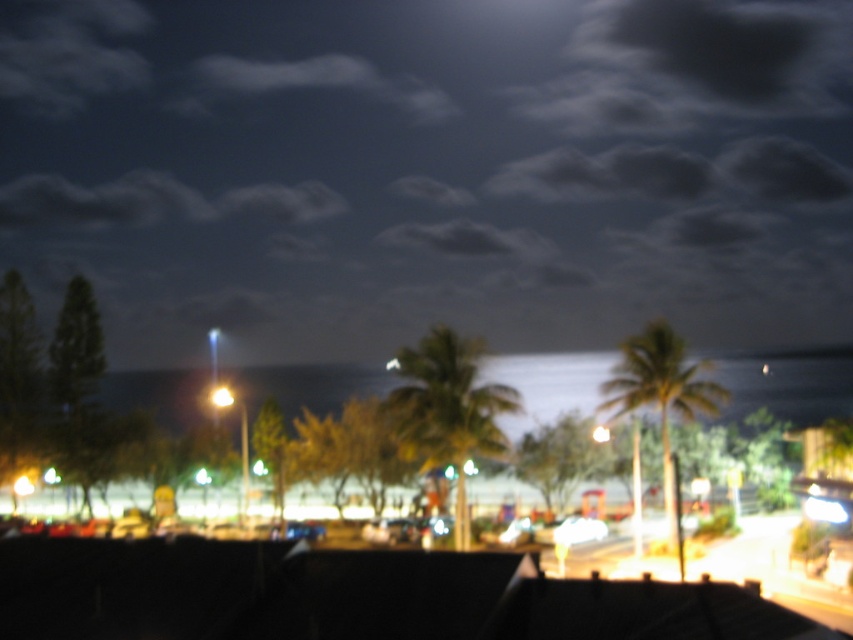
You are an astronomer observing the night sky from a balcony. You notice a green leafy palm tree at center and a yellow matte light at center. Which object appears smaller in the image?

The green leafy palm tree at center appears smaller compared to the yellow matte light at center in the image.

Consider the image. You are standing on a balcony and want to take a photo of two points in the scene. The first point is at coordinates point(125, 544) and the second is at point(222, 394). Which point will appear larger in your photo?

Point(125, 544) will appear larger in the photo because it is closer to the camera than point(222, 394).

You are standing on a balcony and want to estimate how far the black matte roof at lower center is from you. Based on the scene, can you determine the distance?

The distance between the black matte roof at lower center and the viewer is 10.77 meters.